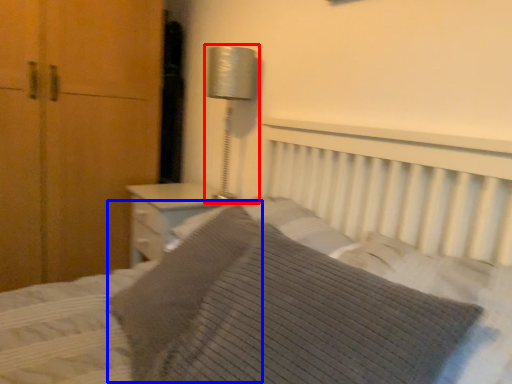
Question: Which of the following is the closest to the observer, bedside lamp (highlighted by a red box) or pillow (highlighted by a blue box)?

Choices:
 (A) bedside lamp
 (B) pillow

Answer: (B)